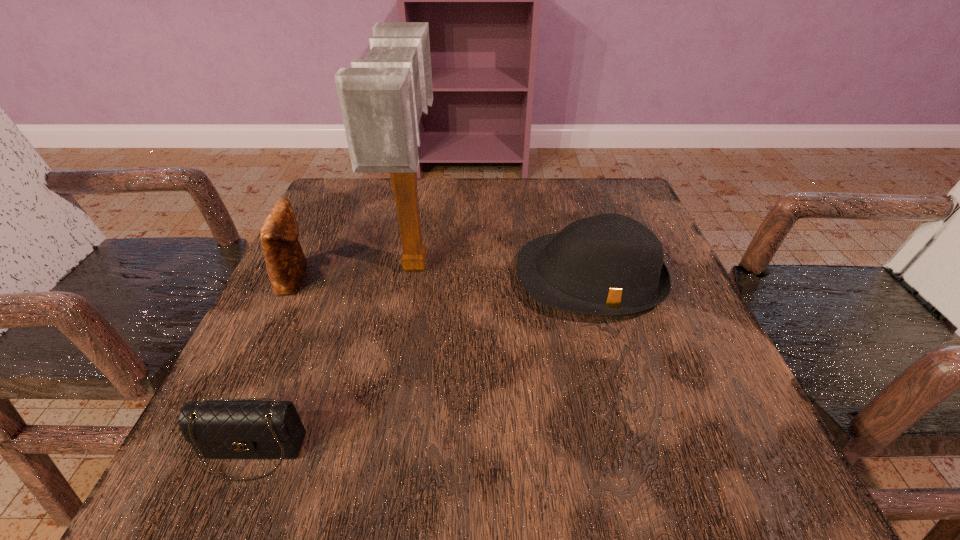
This screenshot has width=960, height=540. I want to click on the tallest object, so click(382, 97).

Identify the location of the second object from right to left. (382, 97).

Locate an element on the screen. This screenshot has width=960, height=540. the taller clutch bag is located at coordinates (285, 261).

What are the coordinates of `fedora` in the screenshot? It's located at (609, 264).

The height and width of the screenshot is (540, 960). I want to click on the second shortest object, so click(x=609, y=264).

At what (x,y) coordinates should I click in order to perform the action: click on the shortest object. Please return your answer as a coordinate pair (x, y). Looking at the image, I should click on (242, 428).

Image resolution: width=960 pixels, height=540 pixels. Identify the location of the shorter clutch bag. (242, 428).

Find the location of `vacant area situated on the left of the third object from left to right`. vacant area situated on the left of the third object from left to right is located at coordinates (313, 264).

Locate an element on the screen. vacant space located 0.260m on the open side of the farther clutch bag is located at coordinates (447, 277).

Where is `vacant area situated on the front-facing side of the fedora`? The image size is (960, 540). vacant area situated on the front-facing side of the fedora is located at coordinates (626, 402).